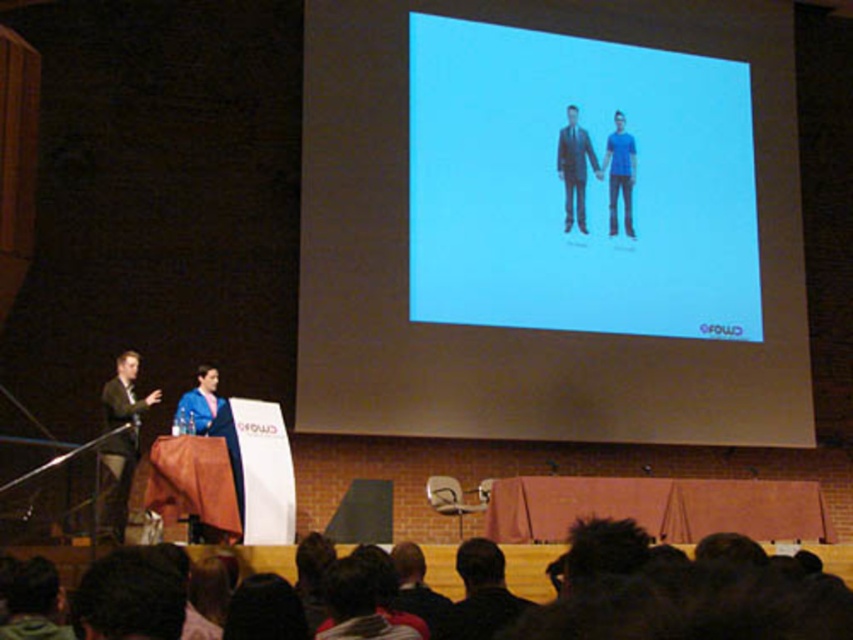
Question: Is blue matte projection screen at upper center to the left of blue matte shirt at center from the viewer's perspective?

Choices:
 (A) yes
 (B) no

Answer: (A)

Question: Which point appears farthest from the camera in this image?

Choices:
 (A) (132, 470)
 (B) (606, 198)

Answer: (B)

Question: Can you confirm if matte black suit at left is positioned to the right of blue matte shirt at center?

Choices:
 (A) yes
 (B) no

Answer: (B)

Question: Considering the real-world distances, which object is farthest from the blue matte shirt at center?

Choices:
 (A) matte black suit at center
 (B) blue matte projection screen at upper center

Answer: (B)

Question: Which is farther from the matte black suit at left?

Choices:
 (A) blue matte shirt at center
 (B) blue matte projection screen at upper center

Answer: (A)

Question: From the image, what is the correct spatial relationship of blue matte projection screen at upper center in relation to matte black suit at left?

Choices:
 (A) right
 (B) left

Answer: (A)